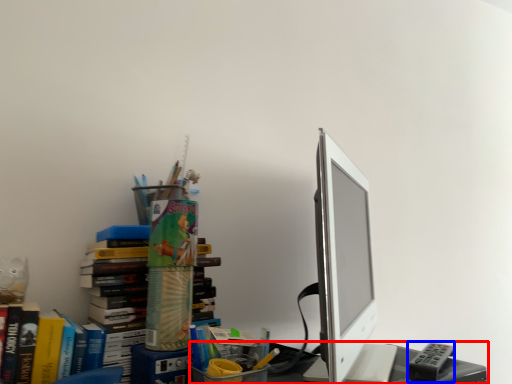
Question: Which of the following is the farthest to the observer, desk (highlighted by a red box) or stationery (highlighted by a blue box)?

Choices:
 (A) desk
 (B) stationery

Answer: (B)